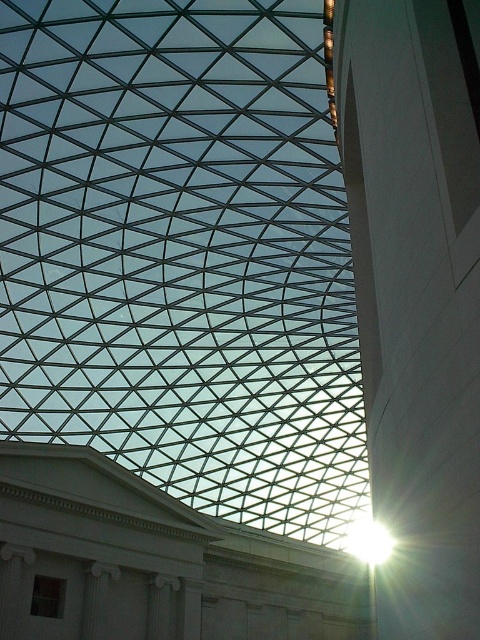
Is transparent glass roof at center above white glossy pillar at right?

No, transparent glass roof at center is not above white glossy pillar at right.

Is point (151, 4) positioned in front of point (392, 51)?

No, it is behind (392, 51).

Is point (203, 150) closer to viewer compared to point (386, 177)?

No, it is not.

Find the location of a particular element. This screenshot has height=640, width=480. transparent glass roof at center is located at coordinates (181, 253).